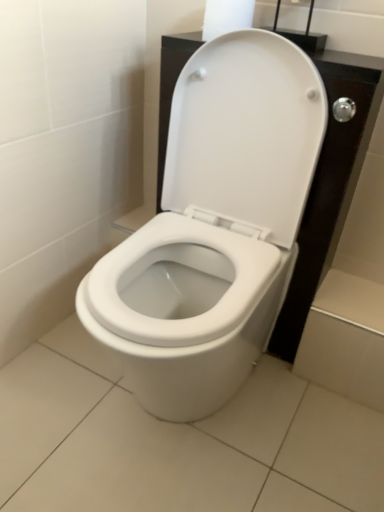
Question: In terms of width, does white paper at upper center look wider or thinner when compared to white glossy toilet at center?

Choices:
 (A) wide
 (B) thin

Answer: (B)

Question: Is white paper at upper center taller or shorter than white glossy toilet at center?

Choices:
 (A) tall
 (B) short

Answer: (B)

Question: In terms of size, does white paper at upper center appear bigger or smaller than white glossy toilet at center?

Choices:
 (A) small
 (B) big

Answer: (A)

Question: Is point (297, 112) closer or farther from the camera than point (248, 26)?

Choices:
 (A) closer
 (B) farther

Answer: (A)

Question: Looking at their shapes, would you say white glossy toilet at center is wider or thinner than white paper at upper center?

Choices:
 (A) thin
 (B) wide

Answer: (B)

Question: Would you say white glossy toilet at center is inside or outside white paper at upper center?

Choices:
 (A) inside
 (B) outside

Answer: (B)

Question: From the image's perspective, is white glossy toilet at center above or below white paper at upper center?

Choices:
 (A) below
 (B) above

Answer: (A)